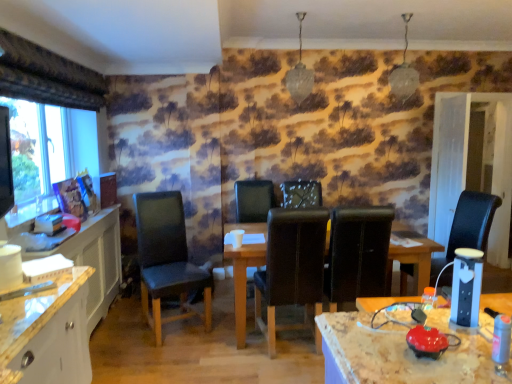
Question: Is leather-like black chair at center, which is counted as the 4th chair, starting from the left, far from matte black monitor at left?

Choices:
 (A) no
 (B) yes

Answer: (B)

Question: Does leather-like black chair at center, which is counted as the 4th chair, starting from the left, have a greater width compared to matte black monitor at left?

Choices:
 (A) no
 (B) yes

Answer: (B)

Question: Is leather-like black chair at center, which is counted as the 4th chair, starting from the left, at the right side of matte black monitor at left?

Choices:
 (A) yes
 (B) no

Answer: (A)

Question: Is leather-like black chair at center, which is counted as the 2th chair, starting from the right, bigger than matte black monitor at left?

Choices:
 (A) yes
 (B) no

Answer: (A)

Question: From a real-world perspective, is leather-like black chair at center, which is counted as the 2th chair, starting from the right, on matte black monitor at left?

Choices:
 (A) yes
 (B) no

Answer: (B)

Question: Can you confirm if leather-like black chair at center, which is counted as the 2th chair, starting from the right, is taller than matte black monitor at left?

Choices:
 (A) yes
 (B) no

Answer: (A)

Question: Is leather-like black chair at center, which is counted as the 2th chair, starting from the right, oriented towards leather at center, arranged as the 2th chair when viewed from the left?

Choices:
 (A) yes
 (B) no

Answer: (B)

Question: Is leather at center, the fourth chair from the right, located within leather-like black chair at center, which is counted as the 4th chair, starting from the left?

Choices:
 (A) no
 (B) yes

Answer: (A)

Question: Is leather-like black chair at center, which is counted as the 2th chair, starting from the right, wider than leather at center, the fourth chair from the right?

Choices:
 (A) no
 (B) yes

Answer: (A)

Question: From a real-world perspective, is leather-like black chair at center, which is counted as the 2th chair, starting from the right, physically below leather at center, arranged as the 2th chair when viewed from the left?

Choices:
 (A) yes
 (B) no

Answer: (B)

Question: Can you confirm if leather-like black chair at center, which is counted as the 4th chair, starting from the left, is thinner than leather at center, arranged as the 2th chair when viewed from the left?

Choices:
 (A) yes
 (B) no

Answer: (A)

Question: Is leather-like black chair at center, which is counted as the 4th chair, starting from the left, positioned with its back to leather at center, arranged as the 2th chair when viewed from the left?

Choices:
 (A) yes
 (B) no

Answer: (B)

Question: Are black leather chair at center, the third chair viewed from the left, and wooden table at center located far from each other?

Choices:
 (A) yes
 (B) no

Answer: (B)